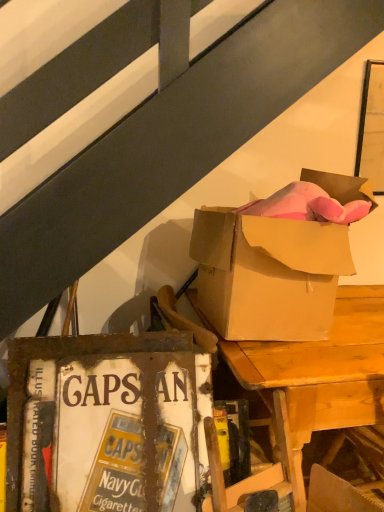
Question: From a real-world perspective, is wooden desk at upper right physically located above or below rusty metal sign at lower left?

Choices:
 (A) above
 (B) below

Answer: (B)

Question: Visually, is wooden desk at upper right positioned to the left or to the right of rusty metal sign at lower left?

Choices:
 (A) right
 (B) left

Answer: (A)

Question: Considering the real-world distances, which object is closest to the rusty metal sign at lower left?

Choices:
 (A) matte cardboard box at upper right
 (B) wooden desk at upper right

Answer: (B)

Question: Which is farther from the matte cardboard box at upper right?

Choices:
 (A) rusty metal sign at lower left
 (B) wooden desk at upper right

Answer: (A)